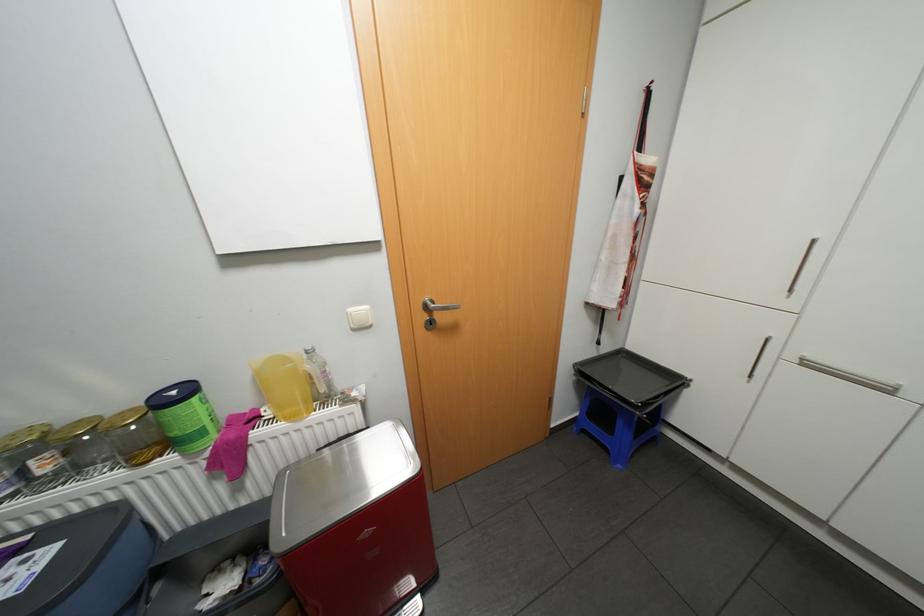
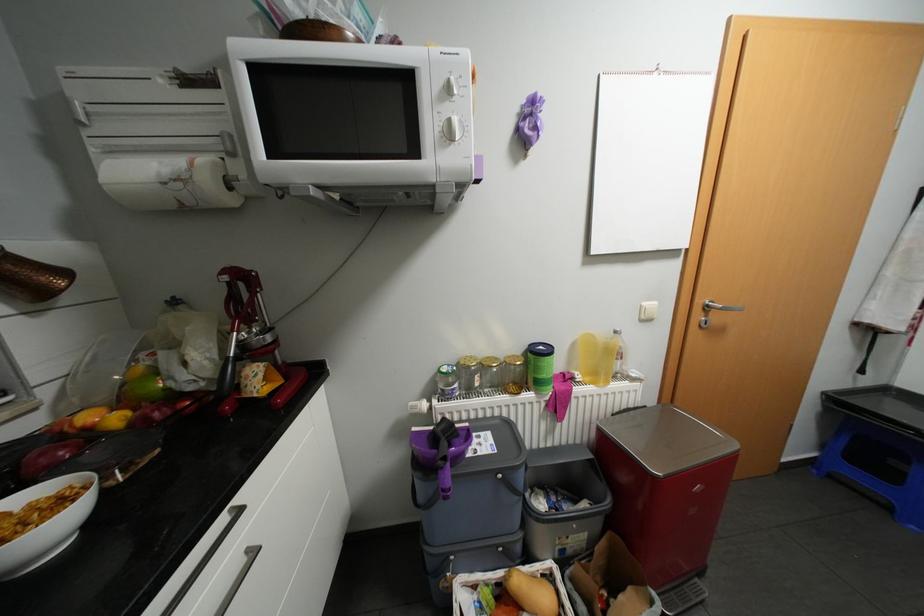
Find the pixel in the second image that matches pixel 88 419 in the first image.

(495, 357)